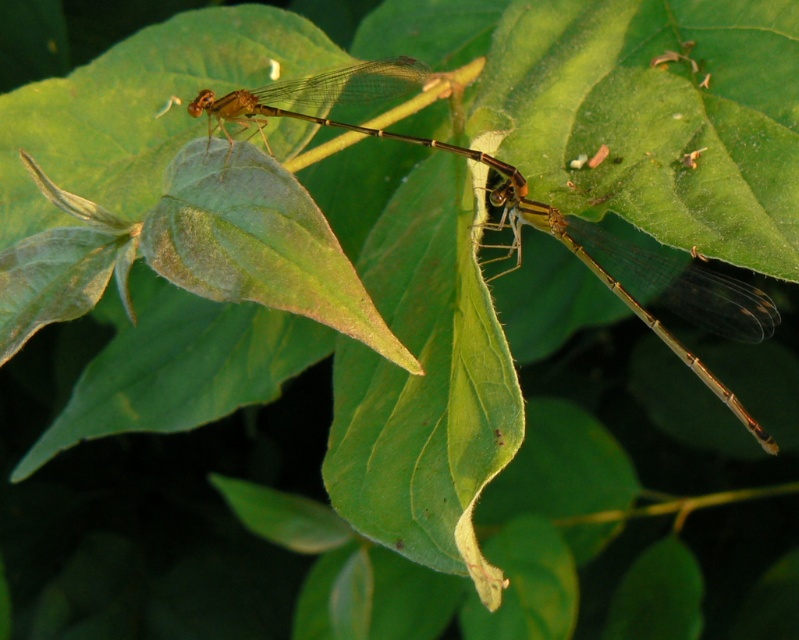
Does translucent amber dragonfly at center have a smaller size compared to translucent amber dragonfly at upper center?

Incorrect, translucent amber dragonfly at center is not smaller in size than translucent amber dragonfly at upper center.

Which is above, translucent amber dragonfly at center or translucent amber dragonfly at upper center?

translucent amber dragonfly at upper center is above.

Which is in front, point (388, 64) or point (209, 141)?

Positioned in front is point (209, 141).

Where is `translucent amber dragonfly at center`? The height and width of the screenshot is (640, 799). translucent amber dragonfly at center is located at coordinates (523, 212).